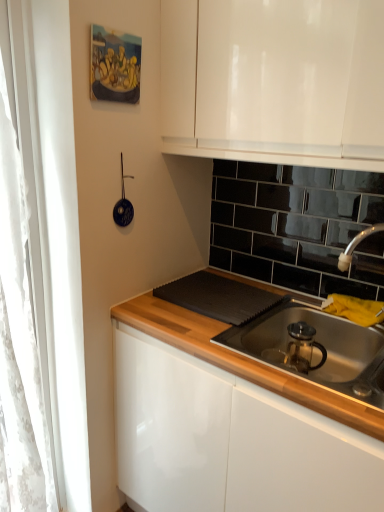
Question: Can you confirm if stainless steel sink at lower right is positioned to the right of blue glossy strainer at upper left?

Choices:
 (A) yes
 (B) no

Answer: (A)

Question: From a real-world perspective, is stainless steel sink at lower right positioned over blue glossy strainer at upper left based on gravity?

Choices:
 (A) yes
 (B) no

Answer: (B)

Question: Can you confirm if stainless steel sink at lower right is positioned to the left of blue glossy strainer at upper left?

Choices:
 (A) no
 (B) yes

Answer: (A)

Question: Does stainless steel sink at lower right have a greater height compared to blue glossy strainer at upper left?

Choices:
 (A) yes
 (B) no

Answer: (B)

Question: Considering the relative sizes of stainless steel sink at lower right and blue glossy strainer at upper left in the image provided, is stainless steel sink at lower right bigger than blue glossy strainer at upper left?

Choices:
 (A) no
 (B) yes

Answer: (B)

Question: From a real-world perspective, is white lace curtain at left positioned above or below blue glossy strainer at upper left?

Choices:
 (A) below
 (B) above

Answer: (A)

Question: In the image, is white lace curtain at left on the left side or the right side of blue glossy strainer at upper left?

Choices:
 (A) left
 (B) right

Answer: (A)

Question: Does point (0, 73) appear closer or farther from the camera than point (120, 174)?

Choices:
 (A) farther
 (B) closer

Answer: (B)

Question: From the image's perspective, relative to blue glossy strainer at upper left, is white lace curtain at left above or below?

Choices:
 (A) above
 (B) below

Answer: (B)

Question: In terms of height, does white lace curtain at left look taller or shorter compared to stainless steel sink at lower right?

Choices:
 (A) tall
 (B) short

Answer: (A)

Question: From a real-world perspective, is white lace curtain at left above or below stainless steel sink at lower right?

Choices:
 (A) below
 (B) above

Answer: (B)

Question: Considering the positions of white lace curtain at left and stainless steel sink at lower right in the image, is white lace curtain at left bigger or smaller than stainless steel sink at lower right?

Choices:
 (A) big
 (B) small

Answer: (B)

Question: Relative to stainless steel sink at lower right, is white lace curtain at left in front or behind?

Choices:
 (A) front
 (B) behind

Answer: (B)

Question: Considering their positions, is blue glossy strainer at upper left located in front of or behind white lace curtain at left?

Choices:
 (A) behind
 (B) front

Answer: (A)

Question: Is blue glossy strainer at upper left wider or thinner than white lace curtain at left?

Choices:
 (A) wide
 (B) thin

Answer: (B)